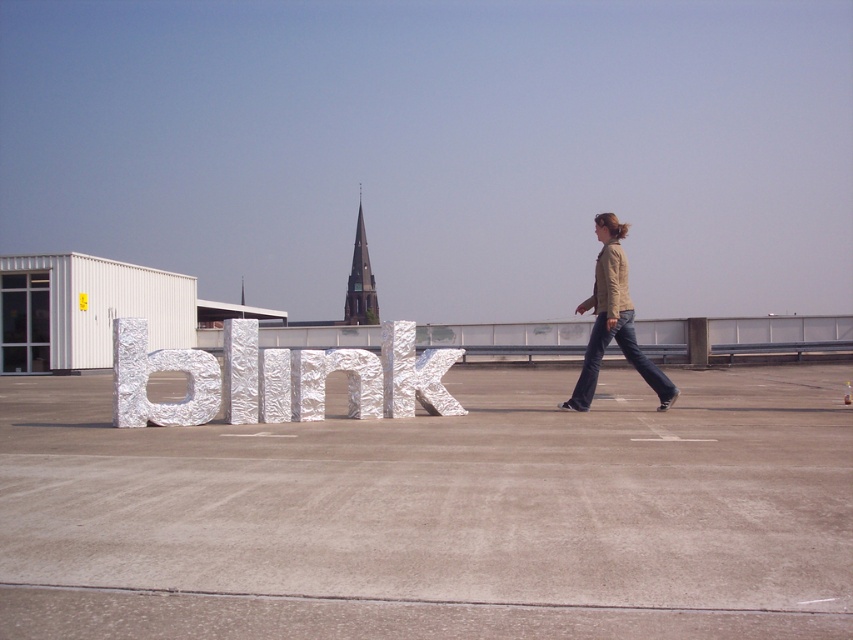
Which is above, shiny metallic letter at center or dark brown stone spire at center?

Positioned higher is dark brown stone spire at center.

Can you confirm if shiny metallic letter at center is positioned below dark brown stone spire at center?

Correct, shiny metallic letter at center is located below dark brown stone spire at center.

Is point (236, 342) positioned behind point (369, 268)?

No, (236, 342) is closer to viewer.

In order to click on shiny metallic letter at center in this screenshot , I will do `click(277, 378)`.

Can you confirm if white concrete tarmac at center is positioned below beige leather jacket at right?

Indeed, white concrete tarmac at center is positioned under beige leather jacket at right.

Is white concrete tarmac at center shorter than beige leather jacket at right?

Yes.

What do you see at coordinates (437, 513) in the screenshot?
I see `white concrete tarmac at center` at bounding box center [437, 513].

Where is `white concrete tarmac at center`? The height and width of the screenshot is (640, 853). white concrete tarmac at center is located at coordinates (437, 513).

Is point (354, 413) behind point (660, 372)?

That is False.

Does shiny metallic letter at center come behind beige leather jacket at right?

No, it is in front of beige leather jacket at right.

I want to click on shiny metallic letter at center, so click(x=277, y=378).